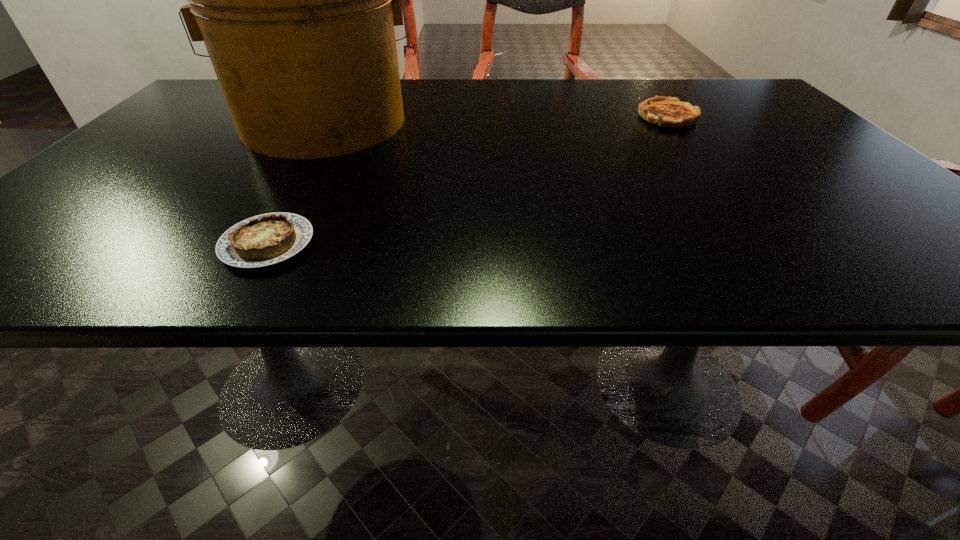
Identify the location of free space that satisfies the following two spatial constraints: 1. on the back side of the left quiche; 2. on the right side of the taller quiche. The width and height of the screenshot is (960, 540). (342, 117).